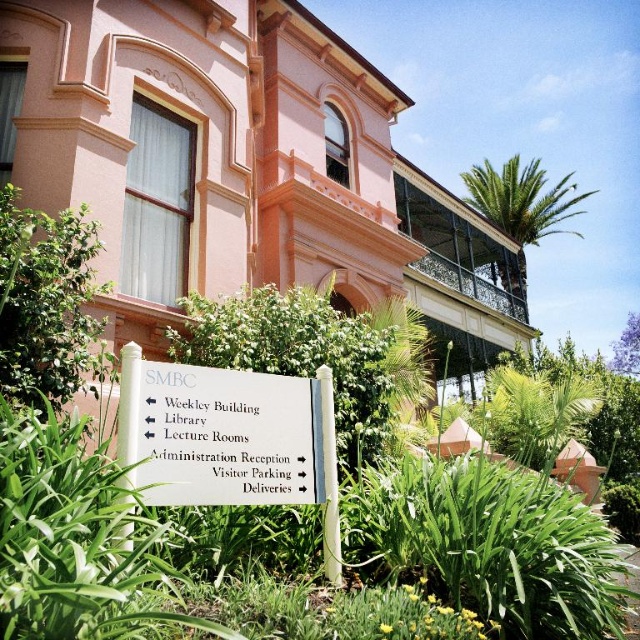
You are standing at the base of the pink matte building at center and want to reach the visitor parking, which is located behind the signpost. The path to the parking requires you to walk around the building. If you walk directly away from the building, how far will you have to walk before you can turn towards the parking area?

The pink matte building at center and viewer are 5.73 meters apart. Since you need to walk around the building, you must first move away from it to reach the parking area. However, the exact distance required to turn towards the parking isn

You are a visitor at the campus and need to find the Weekley Building. You see the pink matte building at center and the white plastic sign at center. Which object should you look at to get directions to the Weekley Building?

The white plastic sign at center provides directional information, so you should look at the white plastic sign at center to find directions to the Weekley Building.